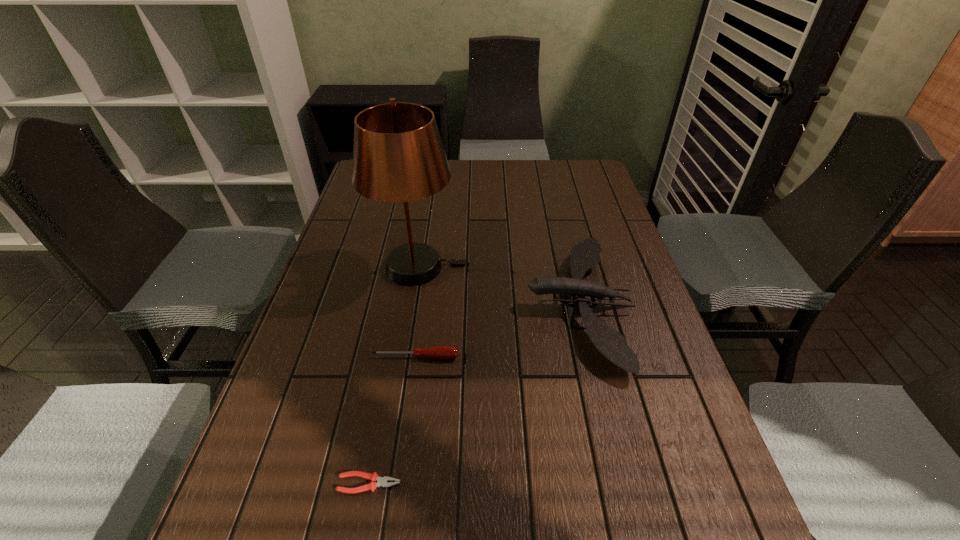
Where is `vacant area located on the right of the third tallest object`? Image resolution: width=960 pixels, height=540 pixels. vacant area located on the right of the third tallest object is located at coordinates (507, 357).

Image resolution: width=960 pixels, height=540 pixels. What are the coordinates of `vacant region located 0.320m on the back of the nearest object` in the screenshot? It's located at (396, 339).

This screenshot has height=540, width=960. In order to click on object positioned at the left edge in this screenshot , I will do `click(398, 156)`.

You are a GUI agent. You are given a task and a screenshot of the screen. Output one action in this format:
    pyautogui.click(x=<x>, y=<y>)
    Task: Click on the object that is at the right edge
    
    Given the screenshot: What is the action you would take?
    pyautogui.click(x=585, y=254)

The height and width of the screenshot is (540, 960). I want to click on free space at the far edge, so click(473, 171).

I want to click on free location at the left edge of the desktop, so click(x=339, y=261).

I want to click on vacant space at the right edge of the desktop, so click(673, 515).

The height and width of the screenshot is (540, 960). Identify the location of vacant area that lies between the pliers and the third tallest object. (393, 420).

At what (x,y) coordinates should I click in order to perform the action: click on vacant point located between the screwdriver and the nearest object. Please return your answer as a coordinate pair (x, y). Looking at the image, I should click on (393, 420).

Locate an element on the screen. free space between the rightmost object and the second shortest object is located at coordinates (497, 331).